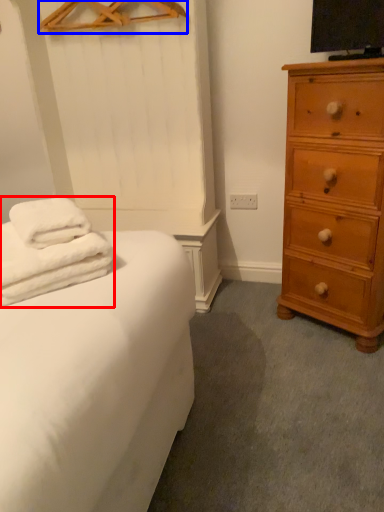
Question: Which object is closer to the camera taking this photo, bath towel (highlighted by a red box) or hanger (highlighted by a blue box)?

Choices:
 (A) bath towel
 (B) hanger

Answer: (A)